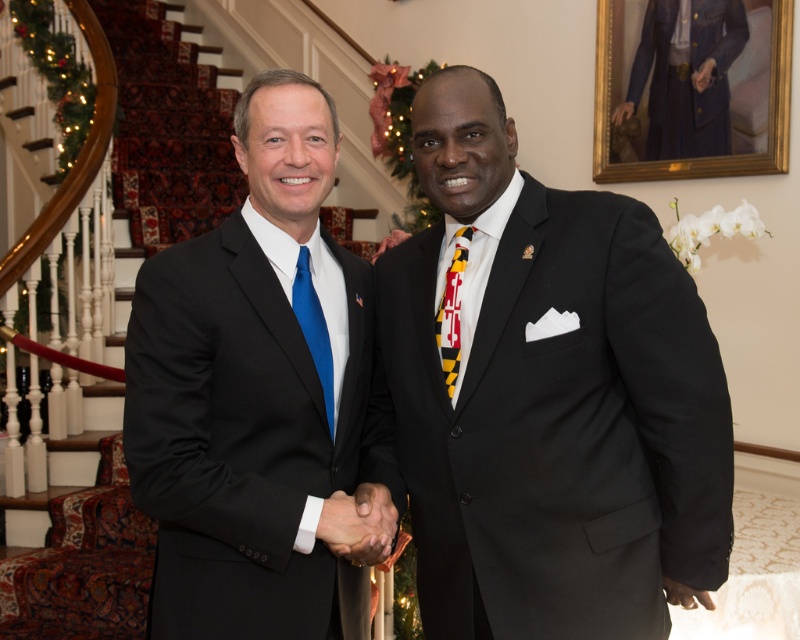
Which is in front, point (314, 305) or point (440, 346)?

Positioned in front is point (440, 346).

This screenshot has width=800, height=640. Describe the element at coordinates (314, 330) in the screenshot. I see `blue silk tie at center` at that location.

The width and height of the screenshot is (800, 640). What are the coordinates of `blue silk tie at center` in the screenshot? It's located at (314, 330).

How much distance is there between matte black suit at center and yellow and black striped tie at center?

The distance of matte black suit at center from yellow and black striped tie at center is 17.05 inches.

Between matte black suit at center and yellow and black striped tie at center, which one appears on the right side from the viewer's perspective?

From the viewer's perspective, yellow and black striped tie at center appears more on the right side.

The width and height of the screenshot is (800, 640). Describe the element at coordinates (252, 392) in the screenshot. I see `matte black suit at center` at that location.

Identify the location of matte black suit at center. Image resolution: width=800 pixels, height=640 pixels. (252, 392).

Where is `black satin suit at center`? Image resolution: width=800 pixels, height=640 pixels. black satin suit at center is located at coordinates (545, 397).

Which is behind, point (500, 483) or point (308, 296)?

Positioned behind is point (308, 296).

What do you see at coordinates (545, 397) in the screenshot? I see `black satin suit at center` at bounding box center [545, 397].

Where is `black satin suit at center`? The height and width of the screenshot is (640, 800). black satin suit at center is located at coordinates (545, 397).